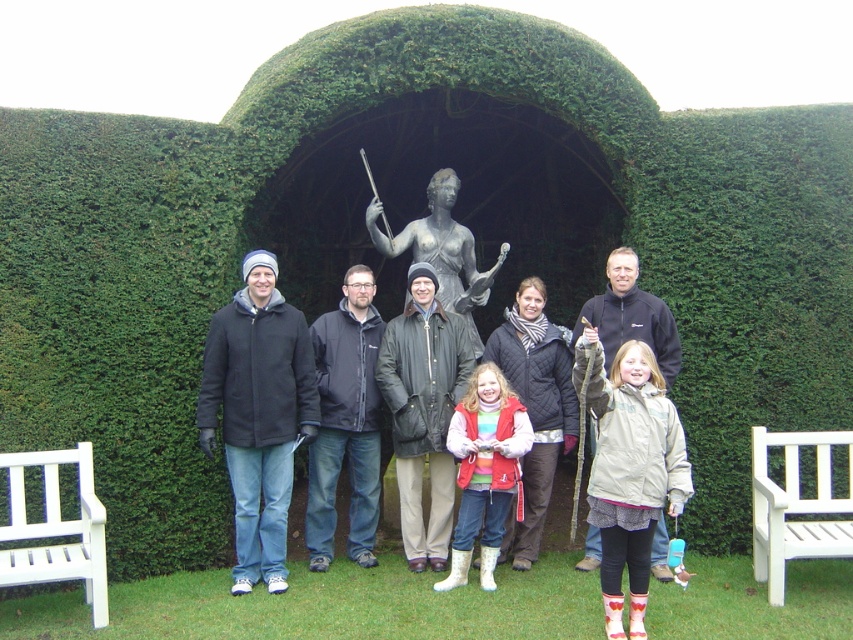
Question: Can you confirm if white wooden bench at lower right is bigger than bronze statue at center?

Choices:
 (A) no
 (B) yes

Answer: (A)

Question: Which object is farther from the camera taking this photo?

Choices:
 (A) white wooden bench at lower left
 (B) dark brown leather jacket at center

Answer: (B)

Question: Which of the following is the closest to the observer?

Choices:
 (A) coord(445,426)
 (B) coord(447,378)

Answer: (A)

Question: Where is matte black jackets at center located in relation to bronze statue at center in the image?

Choices:
 (A) above
 (B) below

Answer: (B)

Question: Does dark brown leather jacket at center appear on the right side of matte black jackets at center?

Choices:
 (A) yes
 (B) no

Answer: (B)

Question: Which point appears closest to the camera in this image?

Choices:
 (A) (450, 204)
 (B) (430, 464)
 (C) (91, 564)
 (D) (363, 317)

Answer: (C)